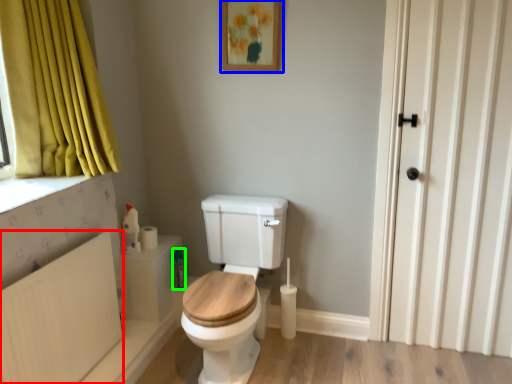
Question: Based on their relative distances, which object is farther from radiator (highlighted by a red box)? Choose from picture frame (highlighted by a blue box) and toiletry (highlighted by a green box).

Choices:
 (A) picture frame
 (B) toiletry

Answer: (A)